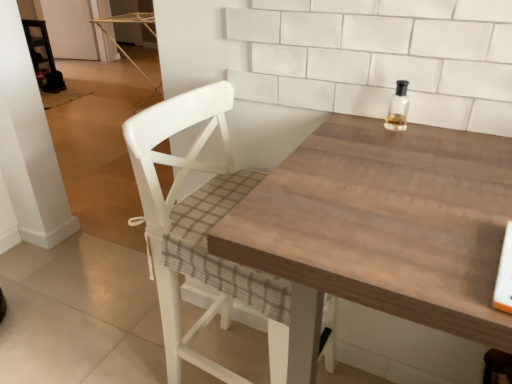
Question: Considering the relative sizes of clear glass bottle at upper right and white wood chair at center in the image provided, is clear glass bottle at upper right shorter than white wood chair at center?

Choices:
 (A) yes
 (B) no

Answer: (A)

Question: Considering the relative sizes of clear glass bottle at upper right and white wood chair at center in the image provided, is clear glass bottle at upper right thinner than white wood chair at center?

Choices:
 (A) no
 (B) yes

Answer: (B)

Question: Is clear glass bottle at upper right turned away from white wood chair at center?

Choices:
 (A) yes
 (B) no

Answer: (B)

Question: From a real-world perspective, does clear glass bottle at upper right stand above white wood chair at center?

Choices:
 (A) no
 (B) yes

Answer: (B)

Question: From the image's perspective, is clear glass bottle at upper right beneath white wood chair at center?

Choices:
 (A) no
 (B) yes

Answer: (A)

Question: In terms of height, does white wood chair at center look taller or shorter compared to wooden table at center?

Choices:
 (A) tall
 (B) short

Answer: (A)

Question: In terms of width, does white wood chair at center look wider or thinner when compared to wooden table at center?

Choices:
 (A) thin
 (B) wide

Answer: (A)

Question: Considering the positions of point (233, 188) and point (340, 271), is point (233, 188) closer or farther from the camera than point (340, 271)?

Choices:
 (A) closer
 (B) farther

Answer: (B)

Question: From the image's perspective, is white wood chair at center positioned above or below wooden table at center?

Choices:
 (A) above
 (B) below

Answer: (A)

Question: In terms of width, does wooden table at center look wider or thinner when compared to white wood chair at center?

Choices:
 (A) thin
 (B) wide

Answer: (B)

Question: Is wooden table at center taller or shorter than white wood chair at center?

Choices:
 (A) tall
 (B) short

Answer: (B)

Question: From the image's perspective, is wooden table at center located above or below white wood chair at center?

Choices:
 (A) below
 (B) above

Answer: (A)

Question: Considering the positions of point (428, 183) and point (124, 124), is point (428, 183) closer or farther from the camera than point (124, 124)?

Choices:
 (A) farther
 (B) closer

Answer: (B)

Question: Is wooden table at center wider or thinner than clear glass bottle at upper right?

Choices:
 (A) thin
 (B) wide

Answer: (B)

Question: Considering the positions of point (424, 155) and point (408, 82), is point (424, 155) closer or farther from the camera than point (408, 82)?

Choices:
 (A) closer
 (B) farther

Answer: (A)